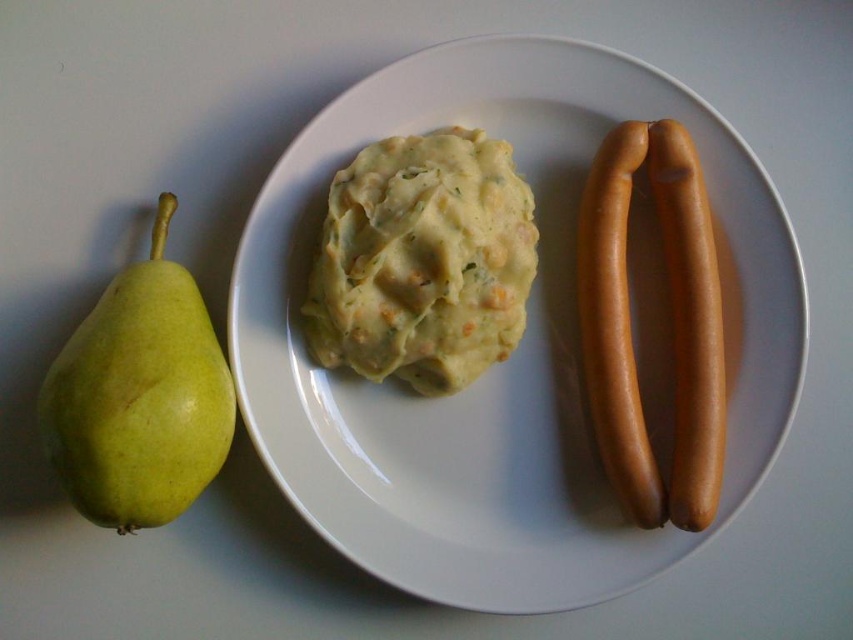
Question: Estimate the real-world distances between objects in this image. Which object is farther from the green matte pear at left?

Choices:
 (A) yellow creamy mashed potato at center
 (B) white glossy plate at center

Answer: (A)

Question: In this image, where is white glossy plate at center located relative to yellow creamy mashed potato at center?

Choices:
 (A) above
 (B) below

Answer: (B)

Question: Does yellow creamy mashed potato at center appear on the right side of brown smooth hot dog at right?

Choices:
 (A) no
 (B) yes

Answer: (A)

Question: Which is nearer to the green matte pear at left?

Choices:
 (A) white glossy plate at center
 (B) brown smooth hot dog at right

Answer: (A)

Question: Observing the image, what is the correct spatial positioning of white glossy plate at center in reference to green matte pear at left?

Choices:
 (A) below
 (B) above

Answer: (B)

Question: Considering the real-world distances, which object is closest to the white glossy plate at center?

Choices:
 (A) yellow creamy mashed potato at center
 (B) green matte pear at left
 (C) brown smooth hot dog at right

Answer: (A)